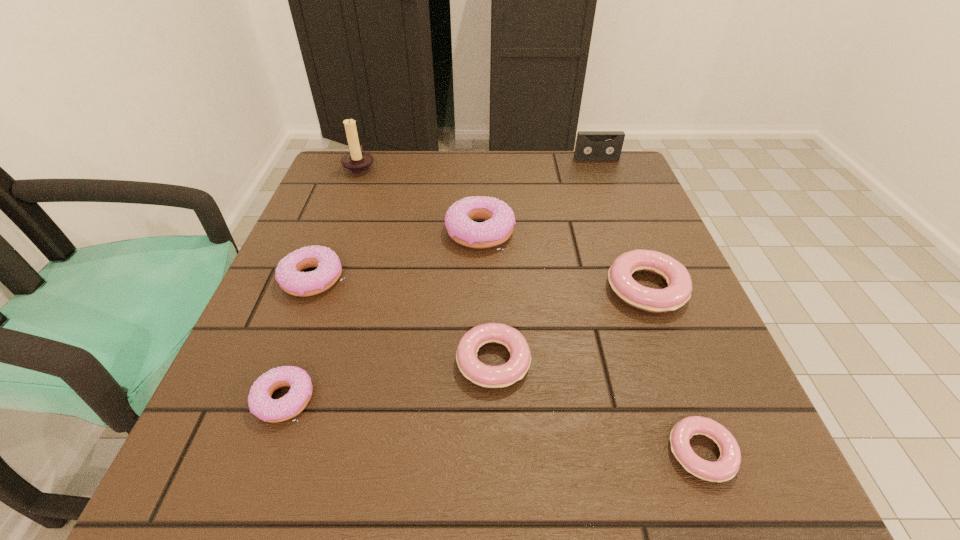
Image resolution: width=960 pixels, height=540 pixels. I want to click on the smallest pink doughnut, so click(725, 468).

Where is `the shortest object`? the shortest object is located at coordinates click(x=725, y=468).

Identify the location of vacant space located on the wick of the brown candle holder. (493, 166).

Where is `free space located 0.380m on the front-facing side of the second tallest object`? Image resolution: width=960 pixels, height=540 pixels. free space located 0.380m on the front-facing side of the second tallest object is located at coordinates pyautogui.click(x=632, y=253).

Identify the location of free space located 0.280m on the front of the sixth nearest object. (480, 368).

You are a GUI agent. You are given a task and a screenshot of the screen. Output one action in this format:
    pyautogui.click(x=<x>, y=<y>)
    Task: Click on the vacant point located on the right of the second farthest purple doughnut
    This screenshot has width=960, height=540.
    Given the screenshot: What is the action you would take?
    pyautogui.click(x=435, y=279)

Locate an element on the screen. This screenshot has height=540, width=960. free location located 0.310m on the back of the biggest pink doughnut is located at coordinates (605, 180).

This screenshot has height=540, width=960. I want to click on free space located on the left of the second biggest pink doughnut, so (x=253, y=361).

Identify the location of free location located on the right of the nearest purple doughnut. (565, 399).

Where is `free space located 0.360m on the left of the nearest pink doughnut`? Image resolution: width=960 pixels, height=540 pixels. free space located 0.360m on the left of the nearest pink doughnut is located at coordinates (407, 453).